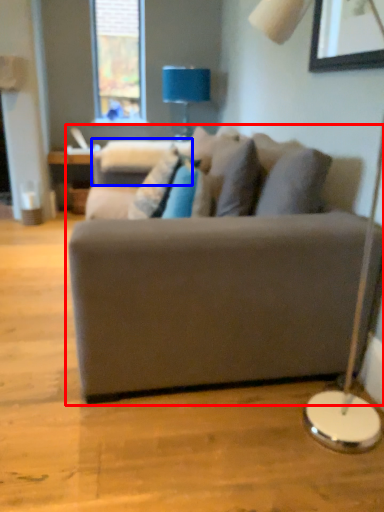
Question: Which point is closer to the camera, studio couch (highlighted by a red box) or swivel chair (highlighted by a blue box)?

Choices:
 (A) studio couch
 (B) swivel chair

Answer: (A)